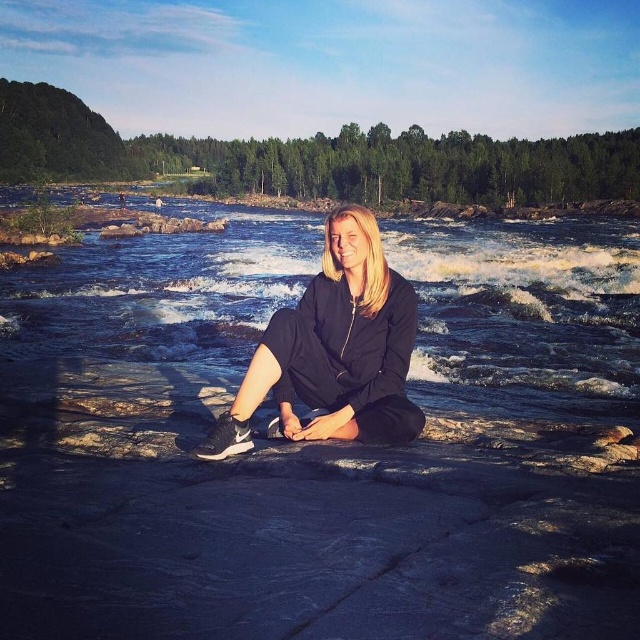
Does smooth stone creek at center come behind black matte tracksuit at center?

No, it is in front of black matte tracksuit at center.

Does smooth stone creek at center have a greater width compared to black matte tracksuit at center?

Correct, the width of smooth stone creek at center exceeds that of black matte tracksuit at center.

This screenshot has height=640, width=640. In order to click on smooth stone creek at center in this screenshot , I will do `click(323, 444)`.

You are a GUI agent. You are given a task and a screenshot of the screen. Output one action in this format:
    pyautogui.click(x=<x>, y=<y>)
    Task: Click on the smooth stone creek at center
    Image resolution: width=640 pixels, height=640 pixels.
    Given the screenshot: What is the action you would take?
    pyautogui.click(x=323, y=444)